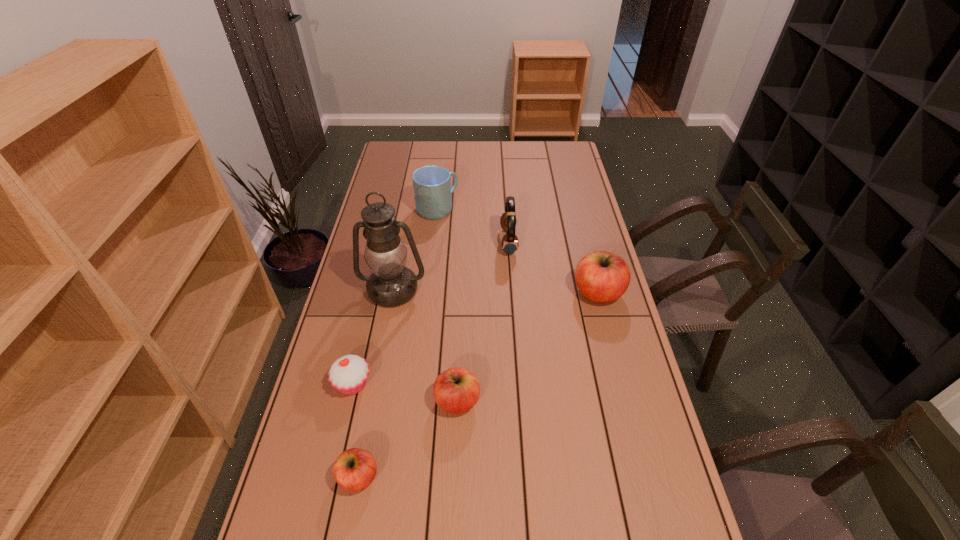
Image resolution: width=960 pixels, height=540 pixels. I want to click on object present at the near edge, so click(x=354, y=469).

This screenshot has height=540, width=960. I want to click on apple at the left edge, so click(x=354, y=469).

I want to click on oil lamp at the left edge, so click(391, 284).

This screenshot has width=960, height=540. Identify the location of cupcake present at the left edge. (348, 374).

At what (x,y) coordinates should I click in order to perform the action: click on object that is at the right edge. Please return your answer as a coordinate pair (x, y). This screenshot has height=540, width=960. Looking at the image, I should click on [602, 277].

Where is `object located in the near left corner section of the desktop`? object located in the near left corner section of the desktop is located at coordinates coord(354,469).

Identify the location of vacant space at the far edge of the desktop. The width and height of the screenshot is (960, 540). (462, 157).

In the image, there is a desktop. Where is `vacant space at the left edge`? This screenshot has height=540, width=960. vacant space at the left edge is located at coordinates (350, 417).

Where is `vacant space at the right edge of the desktop`? vacant space at the right edge of the desktop is located at coordinates (627, 381).

In the image, there is a desktop. In order to click on free region at the far left corner in this screenshot , I will do `click(418, 152)`.